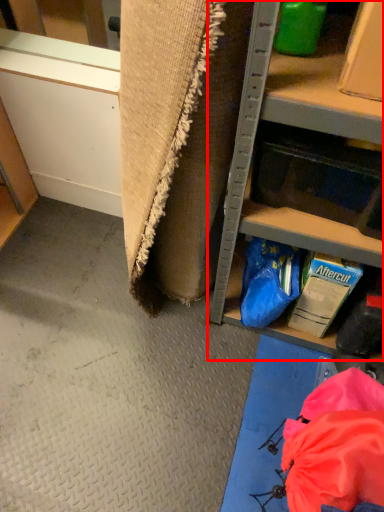
Question: From the image's perspective, where is shelf (annotated by the red box) located in relation to drawer in the image?

Choices:
 (A) below
 (B) above

Answer: (B)